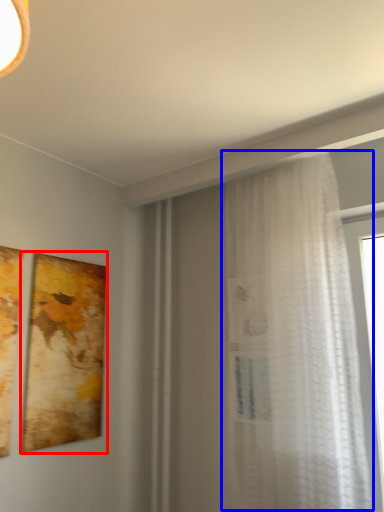
Question: Which object appears farthest to the camera in this image, picture frame (highlighted by a red box) or curtain (highlighted by a blue box)?

Choices:
 (A) picture frame
 (B) curtain

Answer: (A)